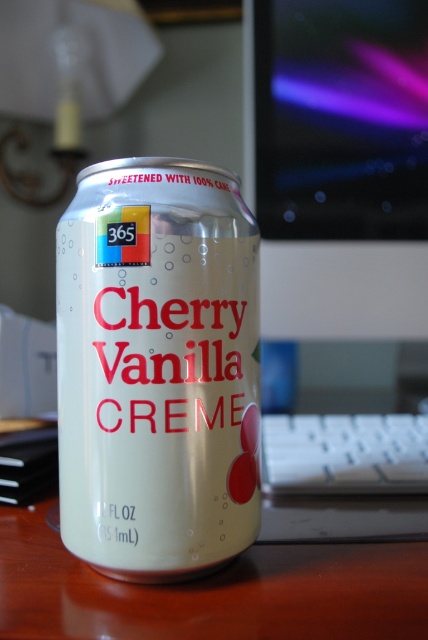
You are organizing items on a desk and need to know if the white matte can at center can fit under the glossy plastic monitor at upper center without blocking it. Can it?

The white matte can at center is not as tall as the glossy plastic monitor at upper center, so it can fit under the monitor without blocking it.

You are looking at the can of Cherry Vanilla Creme soda on the desk. There are two points marked on the can. Which point, point (234, 401) or point (421, 204), is closer to you?

Point (234, 401) is closer to you than point (421, 204).

You are standing in front of a wooden desk and see the image. Where is the white matte can at center located on the desk?

The white matte can at center is located at point coordinates of (157, 369).